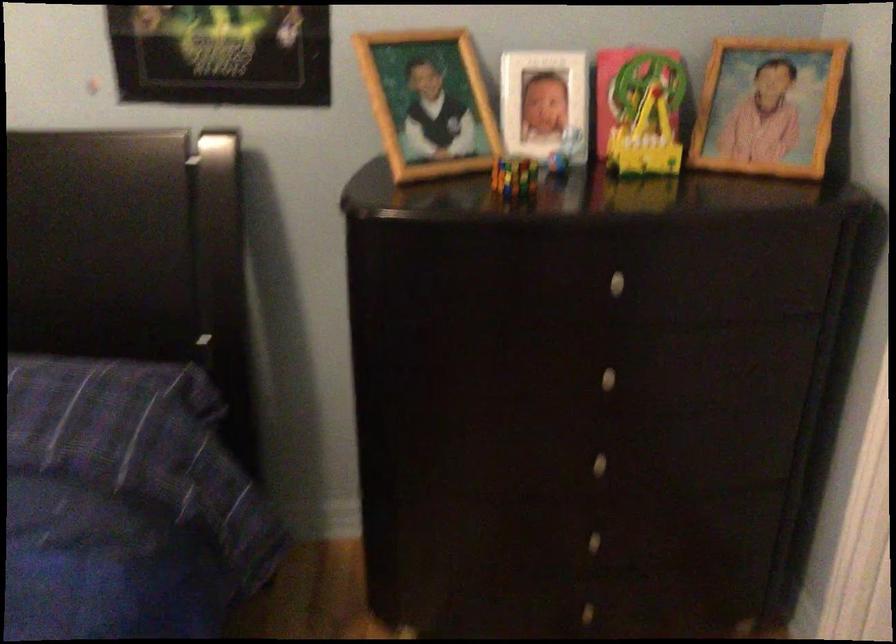
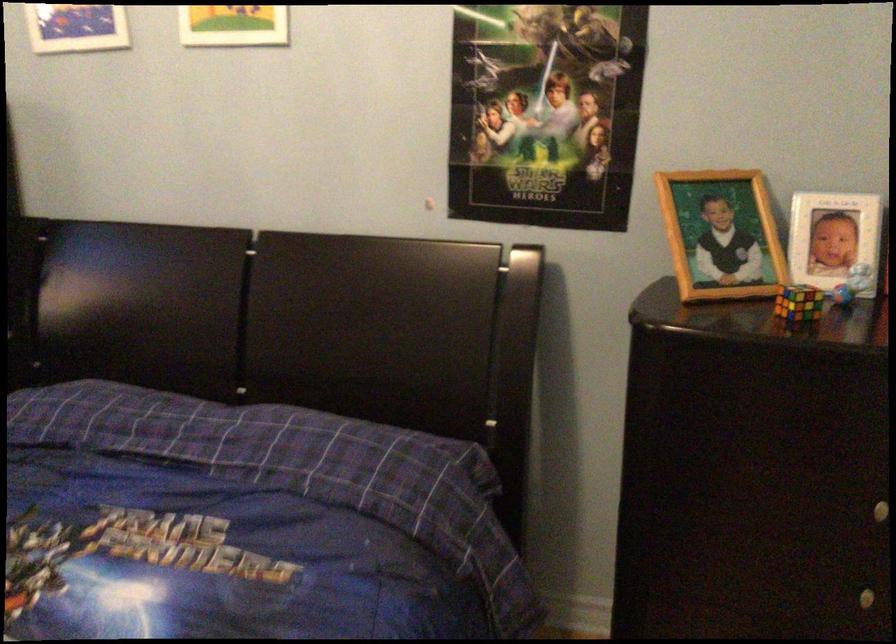
Where in the second image is the point corresponding to [607,459] from the first image?

(868, 597)